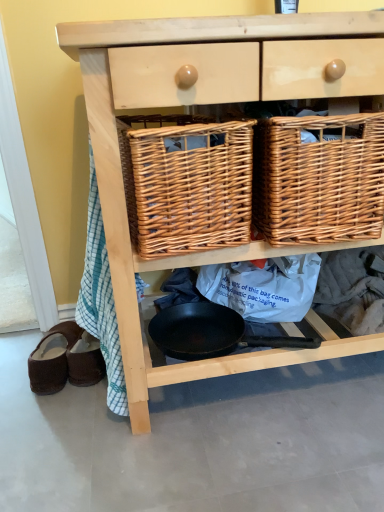
Question: From the image's perspective, relative to black non-stick frying pan at center, is woven brown picnic basket at center, placed as the 1th picnic basket when sorted from right to left, above or below?

Choices:
 (A) above
 (B) below

Answer: (A)

Question: Is woven brown picnic basket at center, placed as the 1th picnic basket when sorted from right to left, taller or shorter than black non-stick frying pan at center?

Choices:
 (A) short
 (B) tall

Answer: (B)

Question: Estimate the real-world distances between objects in this image. Which object is farther from the woven brown picnic basket at center, the 1th picnic basket from the left?

Choices:
 (A) brown suede sandals at lower left, which appears as the 2th footwear when viewed from the left
 (B) woven brown picnic basket at center, placed as the 1th picnic basket when sorted from right to left
 (C) black non-stick frying pan at center
 (D) natural wood chest of drawers at center
 (E) brown suede slippers at lower left, the 1th footwear from the left

Answer: (A)

Question: Estimate the real-world distances between objects in this image. Which object is closer to the woven brown picnic basket at center, the second picnic basket positioned from the right?

Choices:
 (A) black non-stick frying pan at center
 (B) brown suede sandals at lower left, which is the 1th footwear in right-to-left order
 (C) natural wood chest of drawers at center
 (D) brown suede slippers at lower left, the 1th footwear from the left
 (E) woven brown picnic basket at center, placed as the 1th picnic basket when sorted from right to left

Answer: (C)